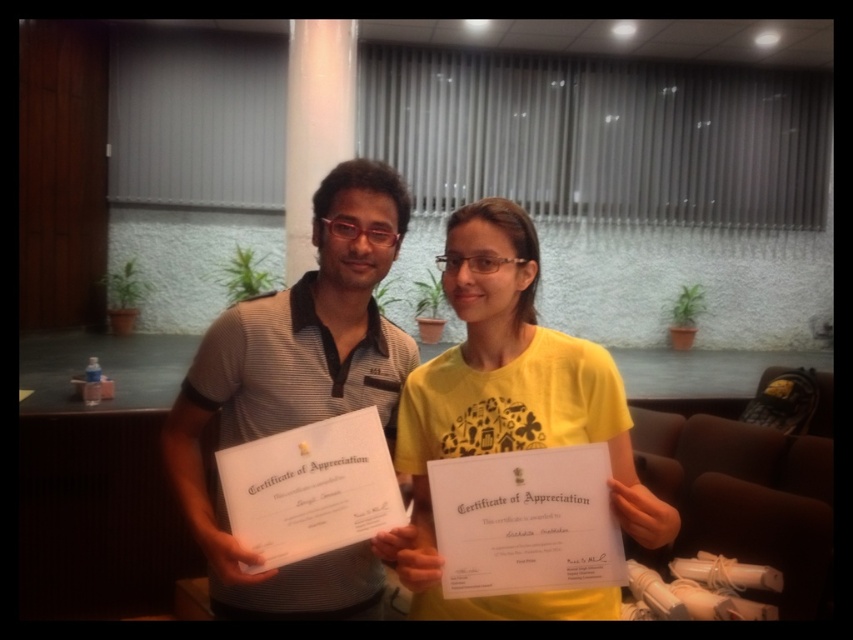
You are organizing a photo shoot and need to ensure that the two shirts in the image are displayed properly. Given that the matte gray shirt at center is wider than the yellow matte shirt at center, which shirt should you place on a wider hanger to avoid bunching?

The matte gray shirt at center should be placed on a wider hanger since its width is larger than the yellow matte shirt at center, preventing bunching.

You are an event photographer who needs to ensure that all participants are visible in the photo. The matte gray shirt at center and the yellow matte shirt at center are both important subjects. Based on their positions, which one is closer to the camera?

The matte gray shirt at center is above the yellow matte shirt at center, so it is closer to the camera.